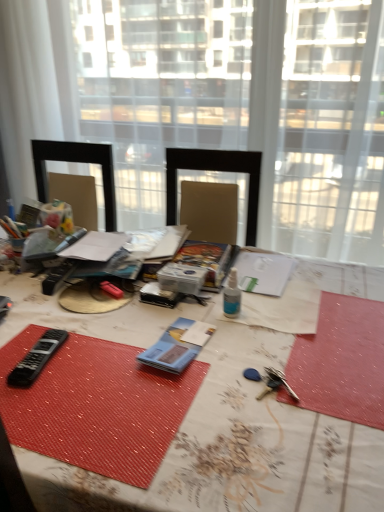
Identify the location of free space between blue paper at center, which is the second equipment in left-to-right order, and black plastic remote at lower left, the second equipment positioned from the right. (107, 353).